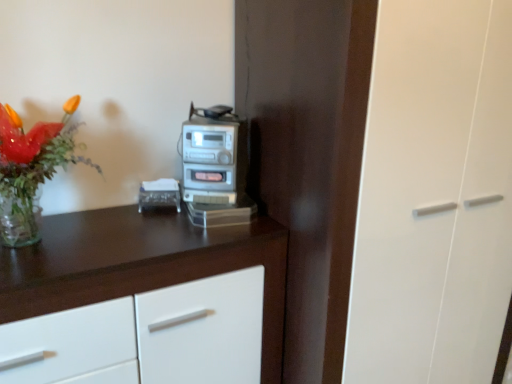
Find the location of a particular element. Image resolution: width=512 pixels, height=384 pixels. free space above white glossy cabinet at upper left (from a real-world perspective) is located at coordinates click(x=103, y=238).